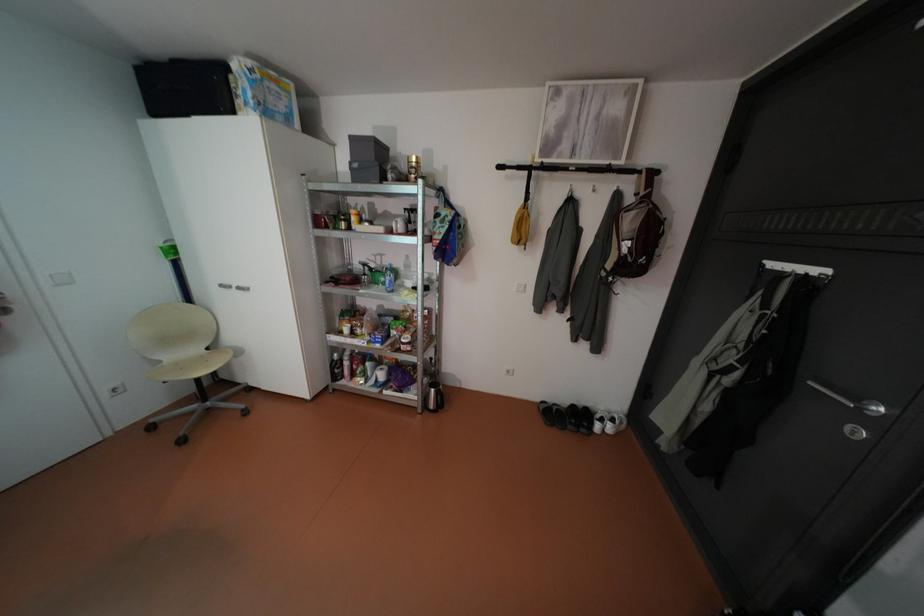
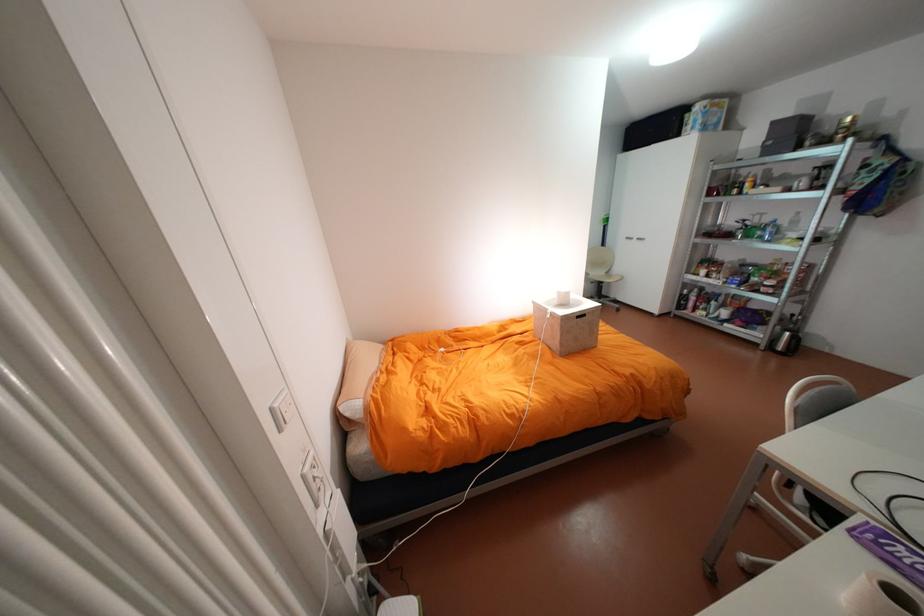
Locate, in the second image, the point that corresponds to pixel 395 261 in the first image.

(775, 219)